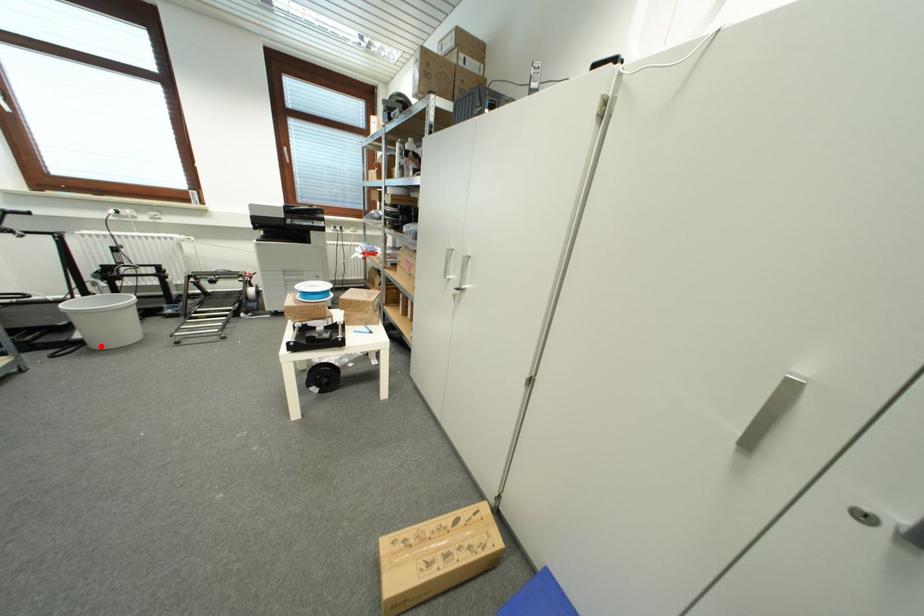
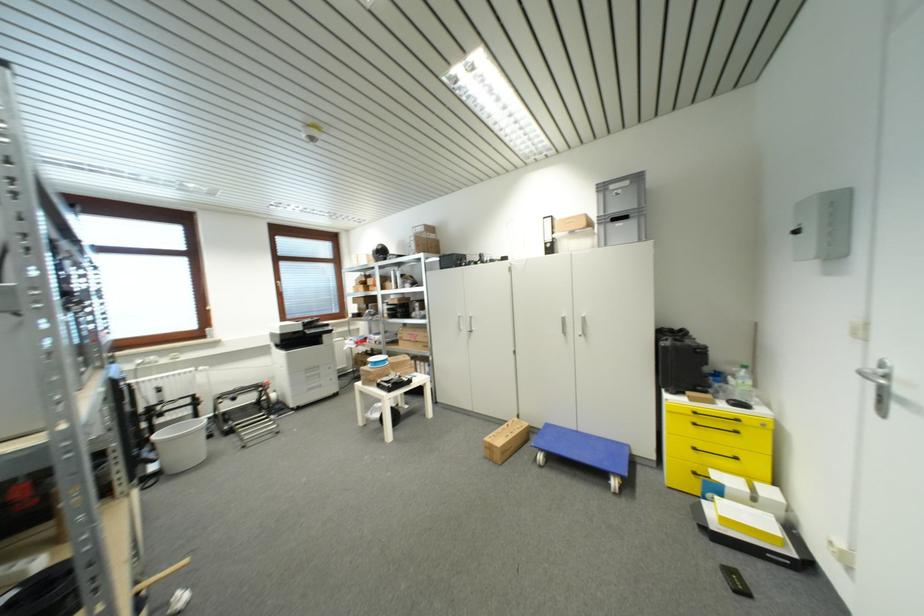
Find the pixel in the second image that matches the highlighted location in the first image.

(177, 472)